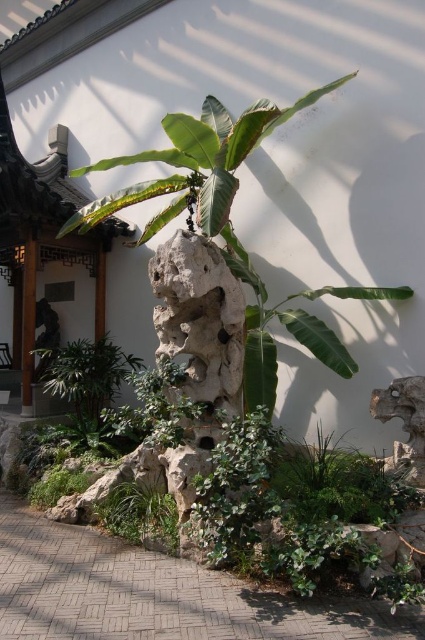
Question: In this image, where is green leafy plant at center located relative to green leafy plant at lower center?

Choices:
 (A) above
 (B) below

Answer: (A)

Question: Which object appears farthest from the camera in this image?

Choices:
 (A) green leafy plant at lower center
 (B) paved brick path at lower center

Answer: (A)

Question: Estimate the real-world distances between objects in this image. Which object is closer to the green leafy plant at center?

Choices:
 (A) paved brick path at lower center
 (B) green leafy plant at lower center

Answer: (B)

Question: Does paved brick path at lower center have a lesser width compared to green leafy plant at center?

Choices:
 (A) yes
 (B) no

Answer: (A)

Question: Is paved brick path at lower center to the left of green leafy plant at lower center from the viewer's perspective?

Choices:
 (A) no
 (B) yes

Answer: (A)

Question: Which point is farther to the camera?

Choices:
 (A) green leafy plant at center
 (B) green leafy plant at lower center

Answer: (A)